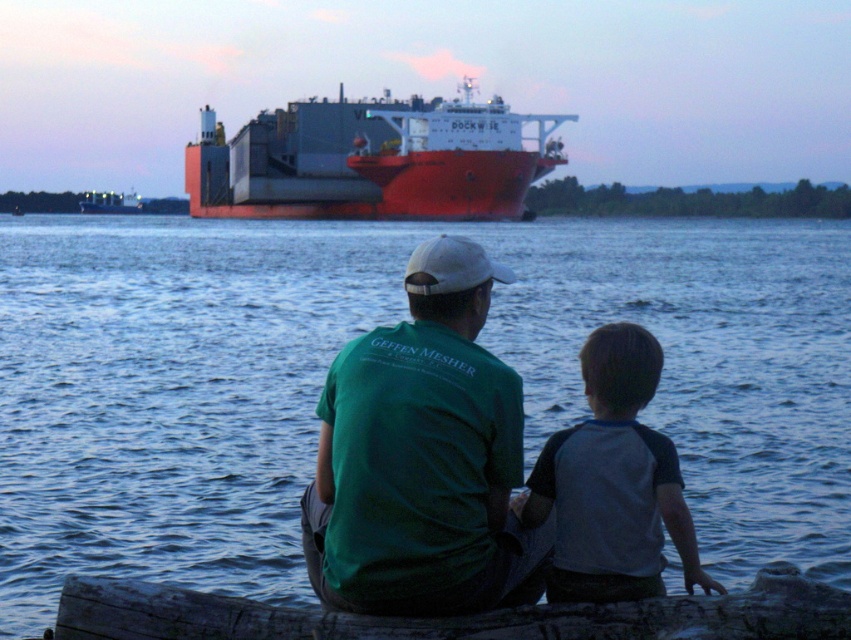
You are a photographer trying to capture a photo of the gray raglan shirt at lower right and the metallic gray container ship at upper center. Which object should you focus on first if you want to ensure both are in sharp focus?

You should focus on the metallic gray container ship at upper center first because it is taller than the gray raglan shirt at lower right. By focusing on the taller object, you can ensure that both objects fall within the depth of field required for sharp focus.

You are a photographer trying to capture the blue water at center and the dark brown wood log at lower center in the same frame. Based on their positions, which object should appear closer to the camera in your photo?

The dark brown wood log at lower center is behind the blue water at center, so the blue water at center will appear closer to the camera in the photo.

You are a photographer trying to capture the gray raglan shirt at lower right and the metallic gray container ship at upper center in the same frame. Which object will appear smaller in your photo?

The gray raglan shirt at lower right will appear smaller in the photo because its width is less than that of the metallic gray container ship at upper center.